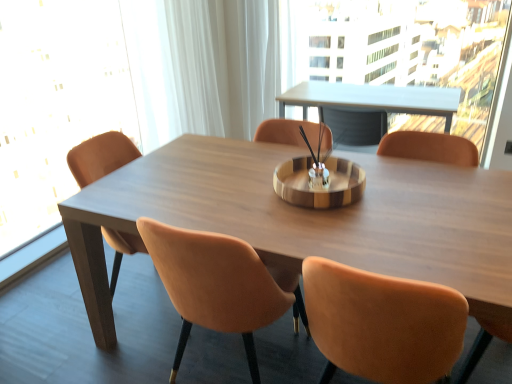
Question: Does transparent glass window screen at left have a greater height compared to matte brown chair at center?

Choices:
 (A) yes
 (B) no

Answer: (A)

Question: Is matte brown chair at center at the back of transparent glass window screen at left?

Choices:
 (A) yes
 (B) no

Answer: (B)

Question: From a real-world perspective, is transparent glass window screen at left positioned over matte brown chair at center based on gravity?

Choices:
 (A) yes
 (B) no

Answer: (A)

Question: Is transparent glass window screen at left completely or partially outside of matte brown chair at center?

Choices:
 (A) yes
 (B) no

Answer: (A)

Question: Can you confirm if transparent glass window screen at left is wider than matte brown chair at center?

Choices:
 (A) yes
 (B) no

Answer: (B)

Question: Does transparent glass window screen at left appear on the left side of matte brown chair at center?

Choices:
 (A) no
 (B) yes

Answer: (B)

Question: Can you confirm if transparent glass window screen at left is positioned to the right of wooden table at center?

Choices:
 (A) no
 (B) yes

Answer: (A)

Question: Can you confirm if transparent glass window screen at left is taller than wooden table at center?

Choices:
 (A) no
 (B) yes

Answer: (B)

Question: From the image's perspective, is transparent glass window screen at left on wooden table at center?

Choices:
 (A) yes
 (B) no

Answer: (A)

Question: Does transparent glass window screen at left have a lesser width compared to wooden table at center?

Choices:
 (A) no
 (B) yes

Answer: (B)

Question: Is transparent glass window screen at left looking in the opposite direction of wooden table at center?

Choices:
 (A) no
 (B) yes

Answer: (A)

Question: From a real-world perspective, is transparent glass window screen at left under wooden table at center?

Choices:
 (A) no
 (B) yes

Answer: (A)

Question: Is transparent glass window screen at left located within matte brown chair at center?

Choices:
 (A) yes
 (B) no

Answer: (B)